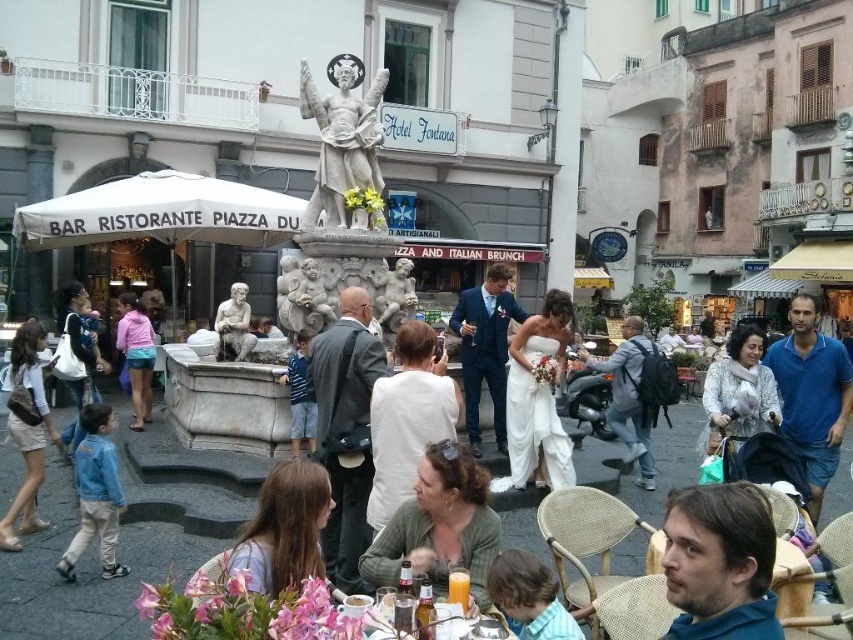
You are a photographer standing in the town square and want to take a photo of the blue cotton shirt at center and the gray fabric jacket at center. Which one is on the right side when looking at the scene?

The blue cotton shirt at center is positioned on the right side of the gray fabric jacket at center, so it is on the right when looking at the scene.

You are standing at the edge of the town square and see the blue cotton shirt at center. If you walk straight ahead, will you reach the fountain before the Hotel Fontana building?

The blue cotton shirt at center is located at point (811, 396), which places it closer to the fountain than the Hotel Fontana building. Therefore, walking straight ahead, you will reach the fountain before the Hotel Fontana building.